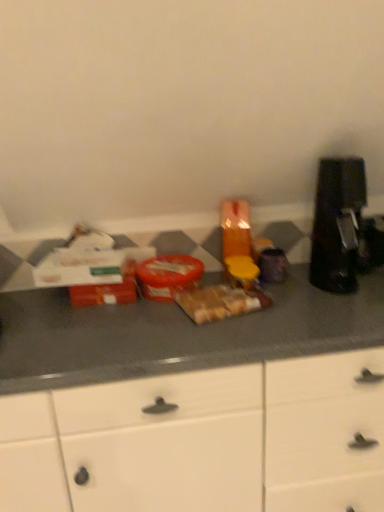
The width and height of the screenshot is (384, 512). Find the location of `blank area to the left of brown matte sandwich at center, marked as the second food in a left-to-right arrangement`. blank area to the left of brown matte sandwich at center, marked as the second food in a left-to-right arrangement is located at coordinates (152, 315).